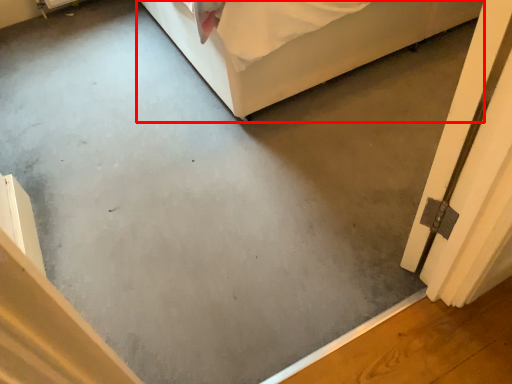
Question: Considering the relative positions of furniture (annotated by the red box) and screen door in the image provided, where is furniture (annotated by the red box) located with respect to the staircase?

Choices:
 (A) right
 (B) left

Answer: (B)